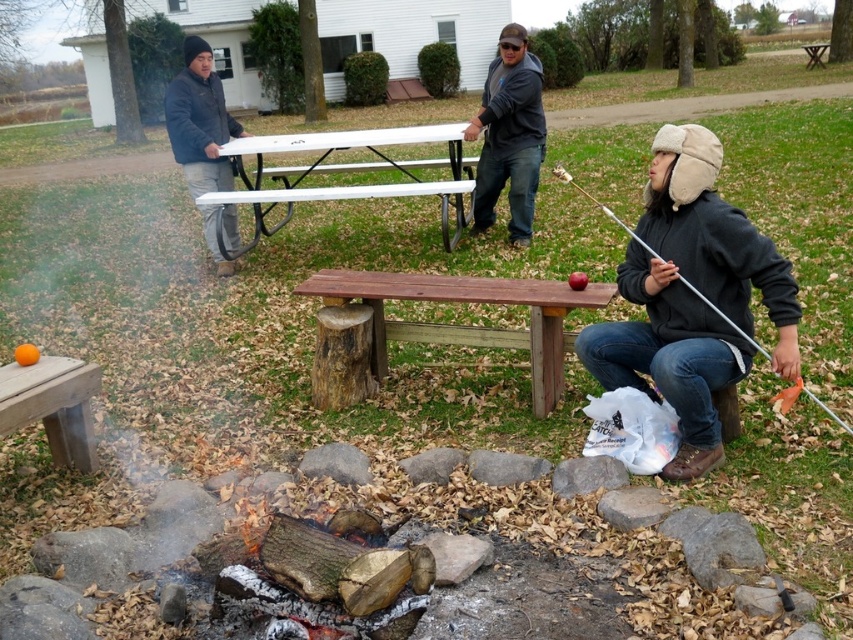
Question: Which point is farther to the camera?

Choices:
 (A) dark gray hoodie at center
 (B) wooden picnic table at lower left

Answer: (A)

Question: Is wooden bench at center below metallic silver fishing pole at lower right?

Choices:
 (A) yes
 (B) no

Answer: (A)

Question: Is the position of white painted wood picnic table at upper center less distant than that of dark gray jacket at left?

Choices:
 (A) yes
 (B) no

Answer: (B)

Question: Can you confirm if white painted wood picnic table at upper center is bigger than dark gray hoodie at center?

Choices:
 (A) no
 (B) yes

Answer: (B)

Question: Which object is closer to the camera taking this photo?

Choices:
 (A) dark gray jacket at left
 (B) wooden bench at center

Answer: (B)

Question: Estimate the real-world distances between objects in this image. Which object is closer to the white painted wood picnic table at upper center?

Choices:
 (A) dark gray jacket at left
 (B) wooden picnic table at lower left
 (C) wooden bench at center
 (D) dark gray hoodie at center

Answer: (A)